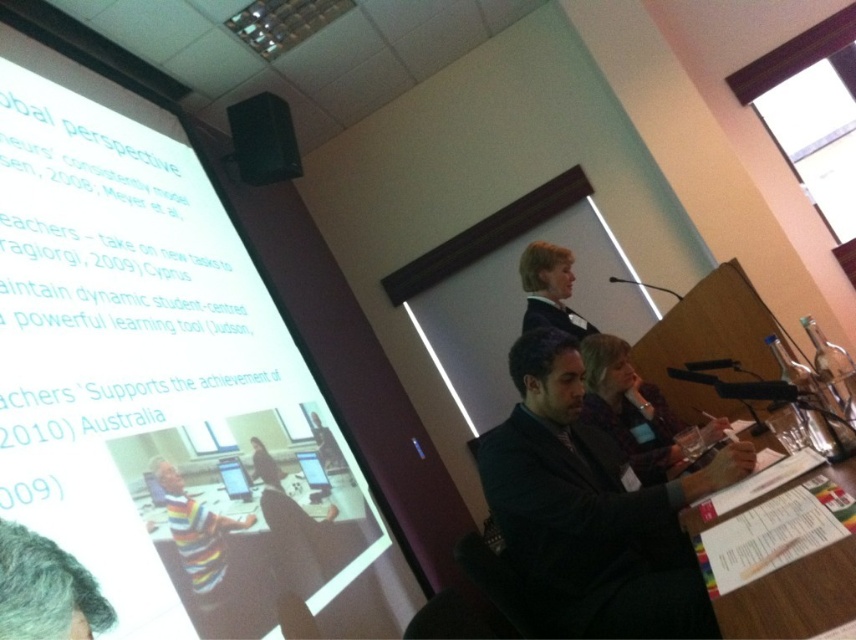
You are a speaker standing at the podium. You need to hand a document to the person wearing the dark gray suit at lower right and the person wearing the striped sweater at center. Which person is closer to you?

The dark gray suit at lower right is 1.02 meters away from the striped sweater at center. Since the speaker is at the podium, which is to the right of the projection screen, the dark gray suit at lower right is closer to the speaker than the striped sweater at center.

You are standing at the front of the room facing the projection screen. You need to locate the dark gray suit at lower right. Where should you look relative to the screen?

The dark gray suit at lower right is located at point (589, 532), which is to the right and slightly below the center of the screen. So you should look to the right side and slightly downward from the center of the projection screen to find it.

You are an attendee at the conference and you want to hand your notes to the person wearing the striped sweater at center. Can you directly hand them the notes without moving past the white paper at lower right?

The white paper at lower right is in front of striped sweater at center, so you would need to move past the white paper at lower right to reach the person wearing the striped sweater at center.